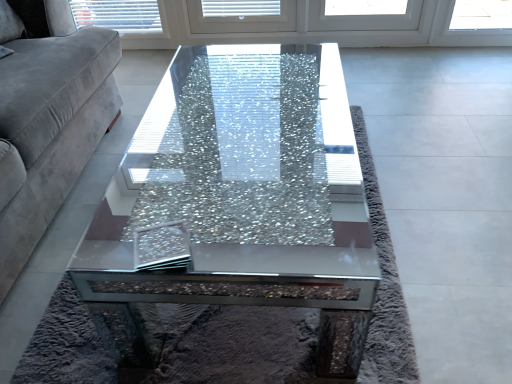
Question: Is velvet gray couch at left smaller than cracked glass coffee table at center?

Choices:
 (A) no
 (B) yes

Answer: (A)

Question: Is velvet gray couch at left positioned far away from cracked glass coffee table at center?

Choices:
 (A) no
 (B) yes

Answer: (A)

Question: From a real-world perspective, is velvet gray couch at left positioned under cracked glass coffee table at center based on gravity?

Choices:
 (A) yes
 (B) no

Answer: (B)

Question: Would you say velvet gray couch at left is outside cracked glass coffee table at center?

Choices:
 (A) yes
 (B) no

Answer: (A)

Question: From a real-world perspective, does velvet gray couch at left stand above cracked glass coffee table at center?

Choices:
 (A) no
 (B) yes

Answer: (B)

Question: Is cracked glass coffee table at center surrounded by velvet gray couch at left?

Choices:
 (A) yes
 (B) no

Answer: (B)

Question: Is cracked glass coffee table at center shorter than velvet gray couch at left?

Choices:
 (A) no
 (B) yes

Answer: (B)

Question: Can you confirm if cracked glass coffee table at center is taller than velvet gray couch at left?

Choices:
 (A) yes
 (B) no

Answer: (B)

Question: Is cracked glass coffee table at center closer to the viewer compared to velvet gray couch at left?

Choices:
 (A) yes
 (B) no

Answer: (B)

Question: From the image's perspective, would you say cracked glass coffee table at center is positioned over velvet gray couch at left?

Choices:
 (A) no
 (B) yes

Answer: (A)

Question: Does cracked glass coffee table at center come behind velvet gray couch at left?

Choices:
 (A) no
 (B) yes

Answer: (B)

Question: Is cracked glass coffee table at center positioned beyond the bounds of velvet gray couch at left?

Choices:
 (A) no
 (B) yes

Answer: (B)

Question: In the image, is velvet gray couch at left positioned in front of or behind cracked glass coffee table at center?

Choices:
 (A) front
 (B) behind

Answer: (A)